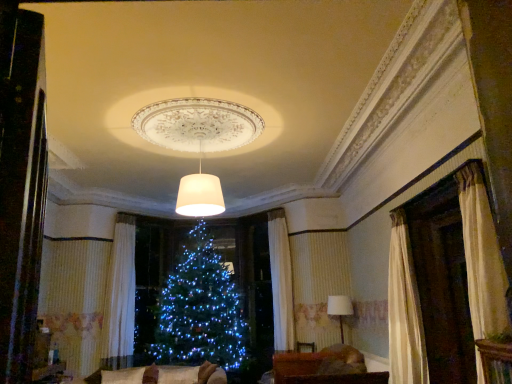
Question: Can you confirm if velvet beige couch at lower center is smaller than brown fabric couch at lower center?

Choices:
 (A) no
 (B) yes

Answer: (A)

Question: Does velvet beige couch at lower center lie behind brown fabric couch at lower center?

Choices:
 (A) yes
 (B) no

Answer: (B)

Question: Is velvet beige couch at lower center aimed at brown fabric couch at lower center?

Choices:
 (A) no
 (B) yes

Answer: (A)

Question: Is velvet beige couch at lower center facing away from brown fabric couch at lower center?

Choices:
 (A) no
 (B) yes

Answer: (A)

Question: Is velvet beige couch at lower center at the right side of brown fabric couch at lower center?

Choices:
 (A) yes
 (B) no

Answer: (B)

Question: Is the depth of velvet beige couch at lower center less than that of brown fabric couch at lower center?

Choices:
 (A) no
 (B) yes

Answer: (B)

Question: Is velvet beige couch at lower center in front of white fabric lampshade at right, which is the 1th lamp in back-to-front order?

Choices:
 (A) yes
 (B) no

Answer: (A)

Question: Does velvet beige couch at lower center appear on the left side of white fabric lampshade at right, the 1th lamp viewed from the right?

Choices:
 (A) yes
 (B) no

Answer: (A)

Question: Is velvet beige couch at lower center positioned with its back to white fabric lampshade at right, which is the 1th lamp in back-to-front order?

Choices:
 (A) yes
 (B) no

Answer: (B)

Question: Is velvet beige couch at lower center oriented towards white fabric lampshade at right, the second lamp viewed from the front?

Choices:
 (A) no
 (B) yes

Answer: (A)

Question: Does velvet beige couch at lower center appear on the right side of white fabric lampshade at right, the second lamp viewed from the front?

Choices:
 (A) yes
 (B) no

Answer: (B)

Question: From a real-world perspective, is velvet beige couch at lower center positioned under white fabric lampshade at right, which is counted as the 2th lamp, starting from the left, based on gravity?

Choices:
 (A) yes
 (B) no

Answer: (A)

Question: From a real-world perspective, is brown fabric couch at lower center below velvet beige couch at lower center?

Choices:
 (A) no
 (B) yes

Answer: (A)